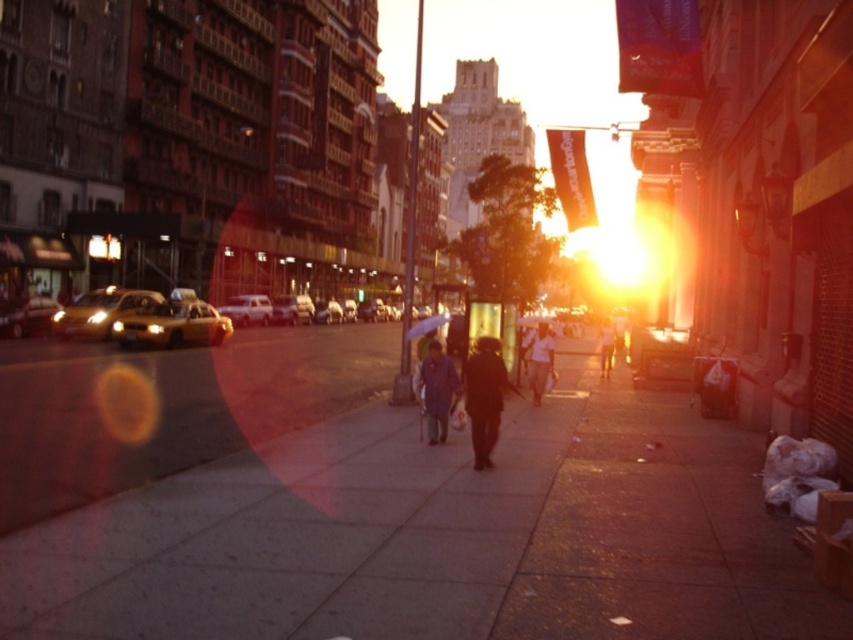
You are a photographer trying to capture a shot of the dark gray jacket at center and the transparent plastic umbrella at center. You want to ensure both are in the frame without any overlap. Based on their positions, which object should you place on the left side of your frame to avoid overlap?

The transparent plastic umbrella at center should be placed on the left side of the frame because the dark gray jacket at center is positioned on the right side of it, so arranging them this way prevents overlap.

You are a photographer trying to capture the brown leather jacket at center and the white matte van at center in the same frame. Based on their sizes, which object should you focus on to ensure both fit in the photo without cropping?

The brown leather jacket at center has a lesser width compared to the white matte van at center, so you should focus on the white matte van at center to ensure both fit in the photo without cropping.

You are a delivery person carrying a large package and need to navigate through the sidewalk. The package is as wide as the white matte shirt at center. Can you walk on the concrete sidewalk at center without the package extending beyond its edges?

The concrete sidewalk at center might be wider than the white matte shirt at center, so there is a possibility that the package will fit. However, since the exact width difference is uncertain, it is recommended to check the actual width before proceeding.